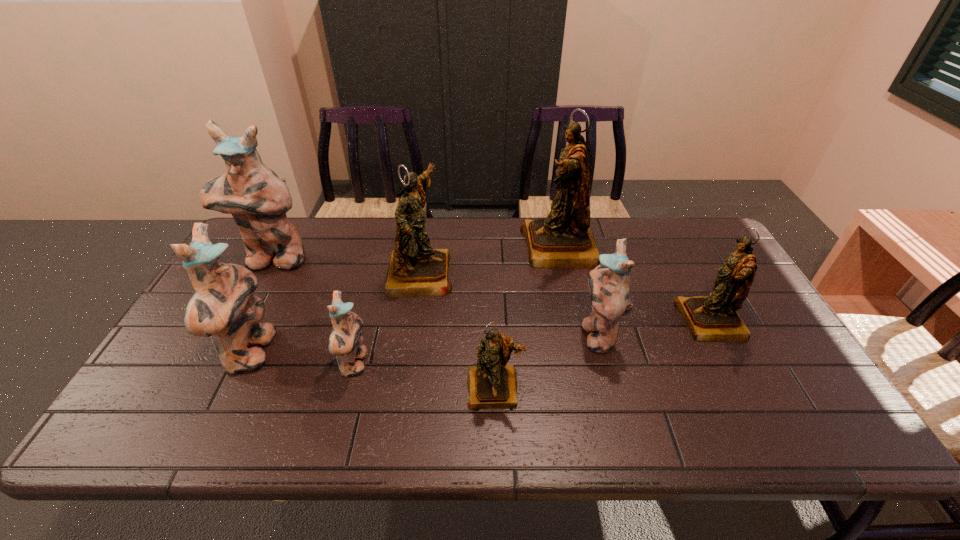
Identify which object is located as the seventh nearest to the second biggest pink figurine. Please provide its 2D coordinates. Your answer should be formatted as a tuple, i.e. [(x, y)], where the tuple contains the x and y coordinates of a point satisfying the conditions above.

[(709, 318)]

This screenshot has width=960, height=540. I want to click on object that stands as the second closest to the smallest pink figurine, so click(x=223, y=307).

The width and height of the screenshot is (960, 540). Find the location of `the seventh closest figurine relative to the smallest gold figurine`. the seventh closest figurine relative to the smallest gold figurine is located at coordinates (257, 198).

I want to click on figurine that is the seventh closest to the third smallest pink figurine, so click(x=709, y=318).

The image size is (960, 540). Identify the location of pink figurine that is the fourth closest to the second smallest gold figurine. (257, 198).

Identify the location of the closest pink figurine to the rightmost gold figurine. This screenshot has width=960, height=540. (608, 283).

At what (x,y) coordinates should I click in order to perform the action: click on gold figurine that is the third closest to the rightmost object. Please return your answer as a coordinate pair (x, y). Looking at the image, I should click on (415, 269).

Find the location of a particular element. Image resolution: width=960 pixels, height=540 pixels. the third closest gold figurine relative to the farthest pink figurine is located at coordinates [564, 239].

You are a GUI agent. You are given a task and a screenshot of the screen. Output one action in this format:
    pyautogui.click(x=<x>, y=<y>)
    Task: Click on the vacant region that satisfies the following two spatial constraints: 1. on the front-facing side of the third biggest gold figurine; 2. on the front-facing side of the fifth figurine from left to right
    This screenshot has width=960, height=540.
    Given the screenshot: What is the action you would take?
    pyautogui.click(x=745, y=388)

The image size is (960, 540). Identify the location of blank area in the image that satisfies the following two spatial constraints: 1. on the front-facing side of the third gold figurine from left to right; 2. on the front-facing side of the farthest pink figurine. (563, 260).